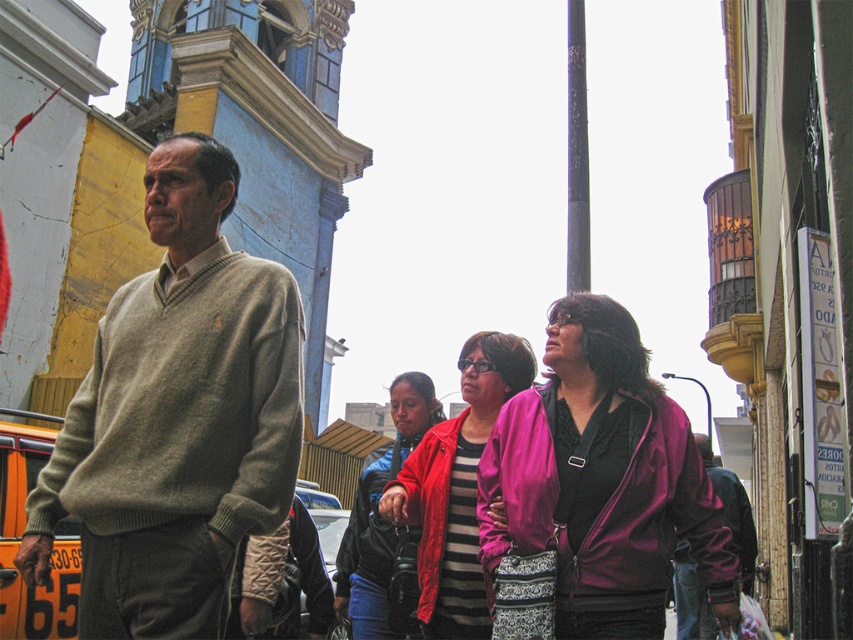
Is matte green sweater at left to the right of matte green sweater at center from the viewer's perspective?

Incorrect, matte green sweater at left is not on the right side of matte green sweater at center.

Between point (10, 627) and point (695, 592), which one is positioned in front?

Positioned in front is point (10, 627).

The width and height of the screenshot is (853, 640). In order to click on matte green sweater at left in this screenshot , I will do `click(22, 531)`.

Between light beige sweater at center and purple matte jacket at center, which one is positioned higher?

Positioned higher is light beige sweater at center.

Which is behind, point (169, 326) or point (627, 353)?

Positioned behind is point (627, 353).

At what (x,y) coordinates should I click in order to perform the action: click on light beige sweater at center. Please return your answer as a coordinate pair (x, y). The width and height of the screenshot is (853, 640). Looking at the image, I should click on (177, 417).

Can you confirm if light beige sweater at center is positioned above matte green sweater at left?

Yes.

How far apart are light beige sweater at center and matte green sweater at left?

light beige sweater at center and matte green sweater at left are 10.60 meters apart.

Who is more distant from viewer, (175, 464) or (28, 412)?

The point (28, 412) is behind.

Where is `light beige sweater at center`? The width and height of the screenshot is (853, 640). light beige sweater at center is located at coordinates (177, 417).